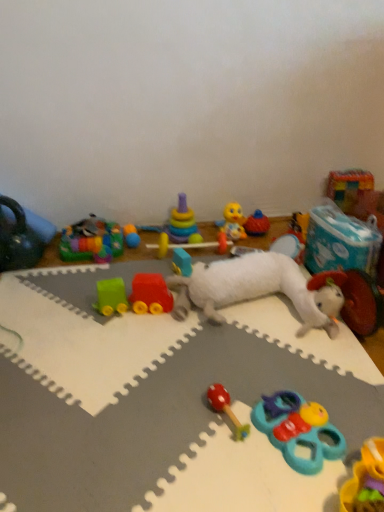
Locate an element on the screen. The width and height of the screenshot is (384, 512). free space between white plush lamb at center, arranged as the 3th toy when viewed from the right, and blue rubber toy at lower right, which is the fifth toy in right-to-left order is located at coordinates (294, 356).